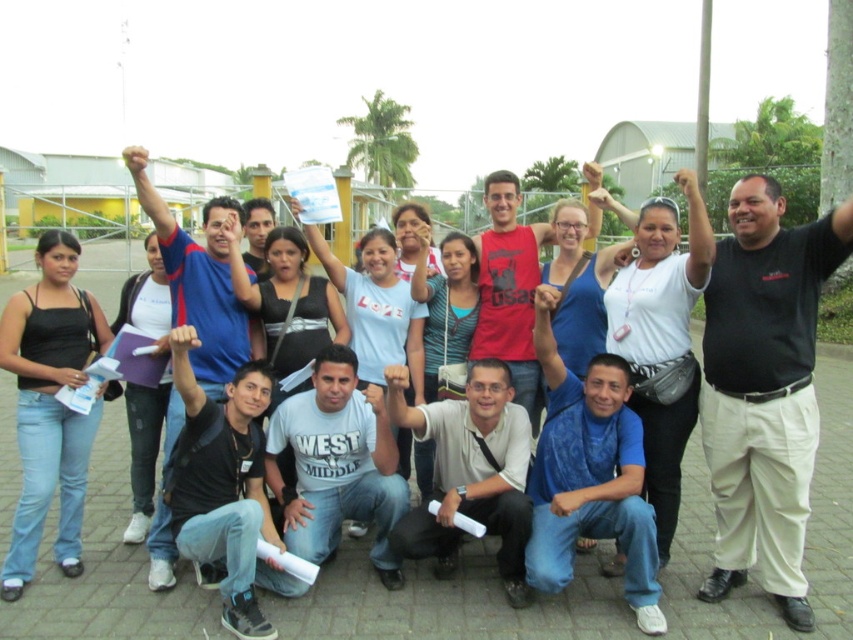
In the scene, there are two people at the center wearing black matte shirt at center and white matte shirt at center. Which one is taller?

The black matte shirt at center is taller than the white matte shirt at center according to the description.

You are a photographer at the event and want to ensure both the black matte shirt at center and the white matte shirt at center are clearly visible in your photo. Which shirt should you focus on to make sure both are in focus?

Since the black matte shirt at center is in front of the white matte shirt at center, focusing on the black matte shirt at center will ensure both are in focus as it is closer to the camera.